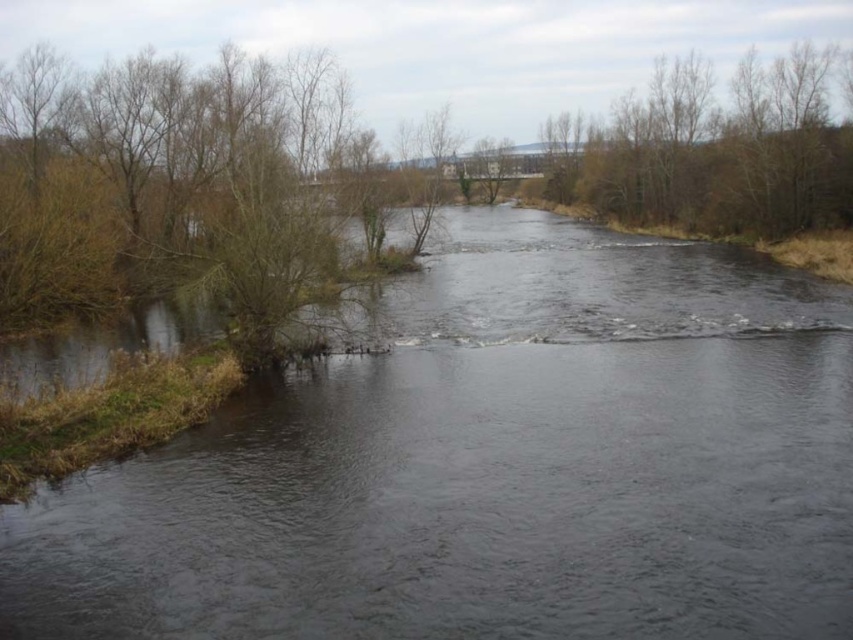
You are standing at the origin point of the image. Which direction should you move to reach the dark water at center?

The dark water at center is located at coordinates point [492,465], so you should move towards the right and upward direction to reach it.

You are standing on the riverbank and see the point marked at coordinates [492,465]. What is the location of this point relative to the dark water at center?

The point marked at coordinates [492,465] is located at the dark water at center.

You are standing on the riverbank and want to cross the river using a small wooden bridge. The bridge is exactly the same width as the brown leafy trees at upper right. Will the bridge be wide enough to span the dark water at center?

The dark water at center is wider than the brown leafy trees at upper right. Since the bridge is the same width as the brown leafy trees at upper right, it will not be wide enough to span the dark water at center.